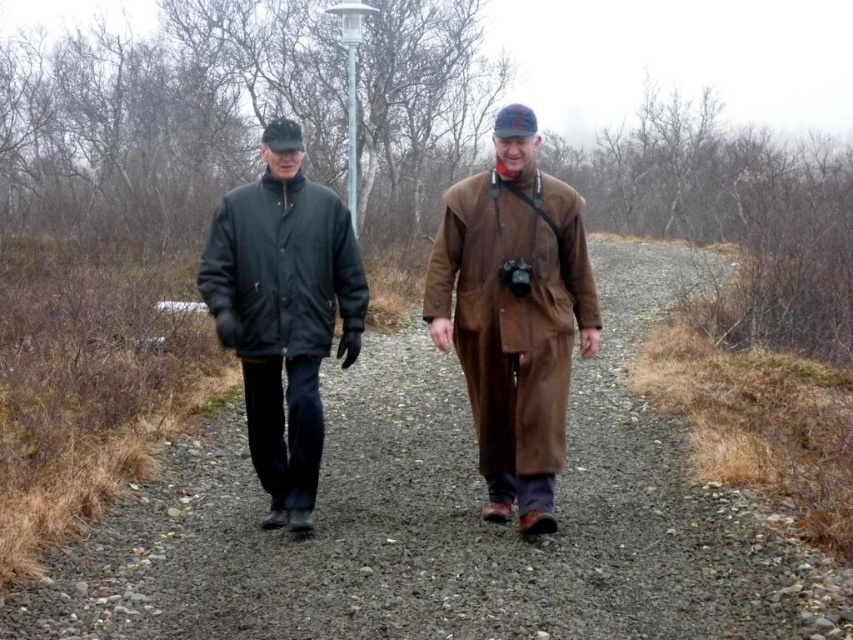
Based on the photo, is matte black jacket at center to the left of brown leather coat at center from the viewer's perspective?

In fact, matte black jacket at center is to the right of brown leather coat at center.

In the scene shown: Does matte black jacket at center appear over brown leather coat at center?

Actually, matte black jacket at center is below brown leather coat at center.

Between point (209, 576) and point (518, 378), which one is positioned behind?

The point (518, 378) is more distant.

At what (x,y) coordinates should I click in order to perform the action: click on matte black jacket at center. Please return your answer as a coordinate pair (x, y). This screenshot has height=640, width=853. Looking at the image, I should click on (447, 520).

Which of these two, matte black jacket at center or matte black jacket at left, stands shorter?

matte black jacket at center

Does matte black jacket at center appear over matte black jacket at left?

No.

I want to click on matte black jacket at center, so click(447, 520).

Which is behind, point (434, 340) or point (345, 307)?

The point (345, 307) is behind.

Which is more to the left, brown leather coat at center or matte black jacket at left?

Positioned to the left is matte black jacket at left.

Between point (519, 161) and point (235, 234), which one is positioned behind?

Point (235, 234)

What are the coordinates of `brown leather coat at center` in the screenshot? It's located at (514, 314).